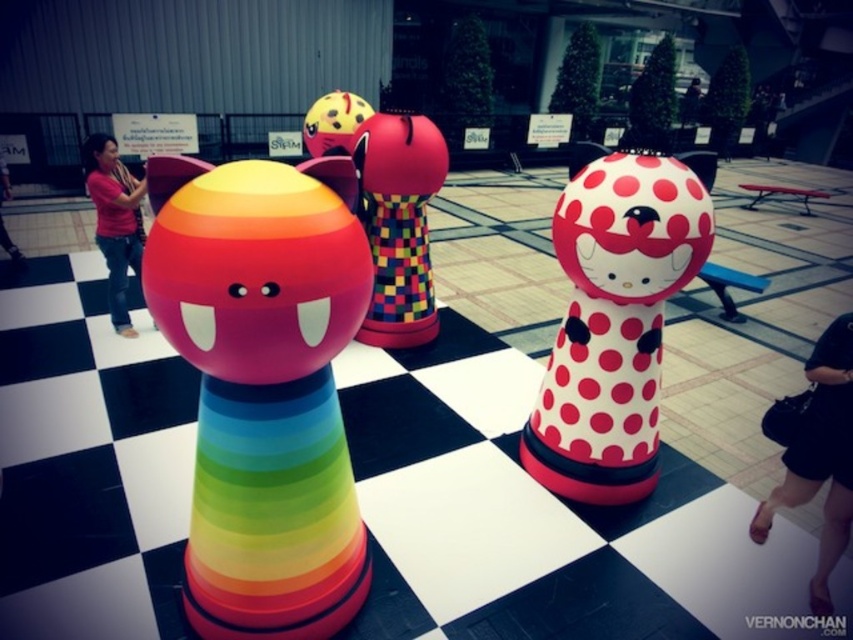
Question: Can you confirm if white glossy hello kitty doll at center is wider than black leather shoes at lower right?

Choices:
 (A) yes
 (B) no

Answer: (A)

Question: Which of the following is the farthest from the observer?

Choices:
 (A) (605, 257)
 (B) (215, 243)

Answer: (A)

Question: Which is farther from the matte yellow rubber ball at center?

Choices:
 (A) rainbow plastic toy at center
 (B) pink fabric shirt at left
 (C) pink fabric person at left

Answer: (C)

Question: Is matte yellow rubber ball at center thinner than pink fabric person at left?

Choices:
 (A) yes
 (B) no

Answer: (A)

Question: Among these objects, which one is farthest from the camera?

Choices:
 (A) rainbow plastic toy at center
 (B) matte rainbow cone at center
 (C) pink fabric shirt at left

Answer: (B)

Question: Can you confirm if white glossy hello kitty doll at center is positioned below black leather shoes at lower right?

Choices:
 (A) yes
 (B) no

Answer: (B)